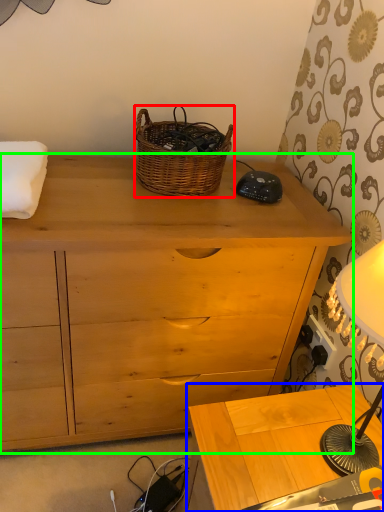
Question: Based on their relative distances, which object is nearer to picnic basket (highlighted by a red box)? Choose from table (highlighted by a blue box) and chest of drawers (highlighted by a green box).

Choices:
 (A) table
 (B) chest of drawers

Answer: (B)